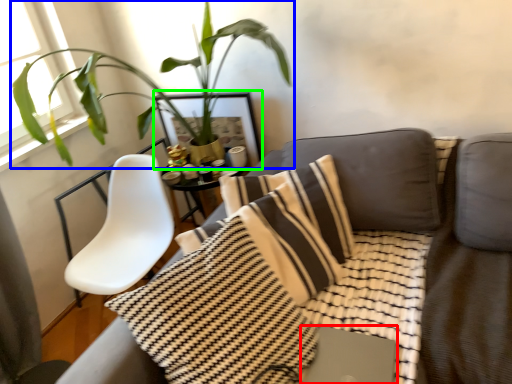
Question: Which object is the closest to the computer (highlighted by a red box)? Choose among these: houseplant (highlighted by a blue box) or picture frame (highlighted by a green box).

Choices:
 (A) houseplant
 (B) picture frame

Answer: (B)